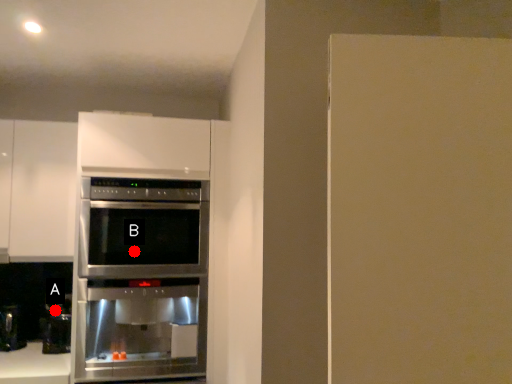
Question: Two points are circled on the image, labeled by A and B beside each circle. Which point is farther to the camera?

Choices:
 (A) A is further
 (B) B is further

Answer: (A)